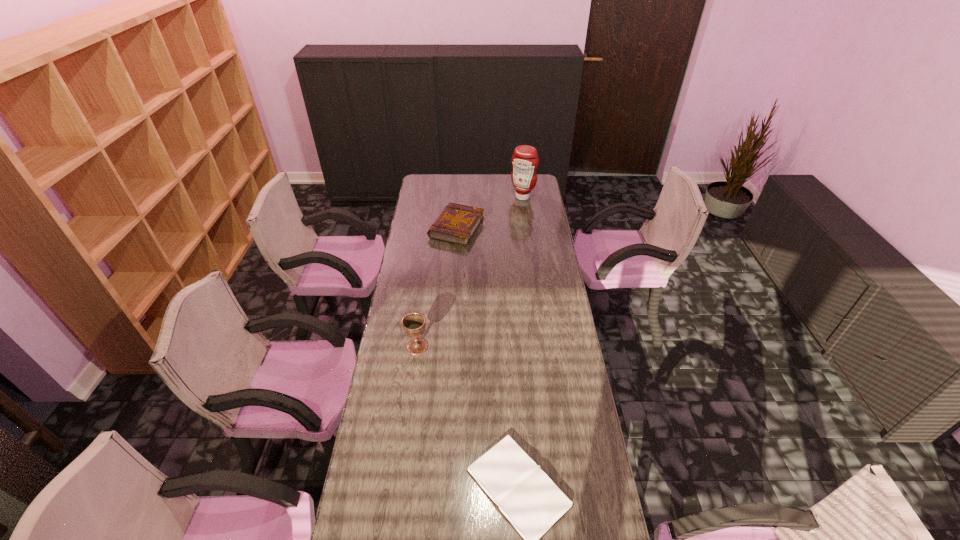
This screenshot has width=960, height=540. I want to click on free spot between the third shortest object and the condiment, so click(x=470, y=272).

Find the location of a particular element. The image size is (960, 540). the closest object relative to the farther hardback book is located at coordinates (525, 160).

Locate which object is the third closest to the shortest object. Please provide its 2D coordinates. Your answer should be formatted as a tuple, i.e. [(x, y)], where the tuple contains the x and y coordinates of a point satisfying the conditions above.

[(525, 160)]

This screenshot has width=960, height=540. In order to click on free spot that satisfies the following two spatial constraints: 1. on the back side of the second shortest object; 2. on the right side of the third shortest object in this screenshot , I will do `click(433, 228)`.

Find the location of `free spot that satisfies the following two spatial constraints: 1. on the back side of the third shortest object; 2. on the right side of the second farthest object`. free spot that satisfies the following two spatial constraints: 1. on the back side of the third shortest object; 2. on the right side of the second farthest object is located at coordinates (433, 228).

Find the location of `free spot that satisfies the following two spatial constraints: 1. on the back side of the farther hardback book; 2. on the left side of the third farthest object`. free spot that satisfies the following two spatial constraints: 1. on the back side of the farther hardback book; 2. on the left side of the third farthest object is located at coordinates (433, 228).

Identify the location of free space that satisfies the following two spatial constraints: 1. on the back side of the chalice; 2. on the right side of the condiment. (438, 197).